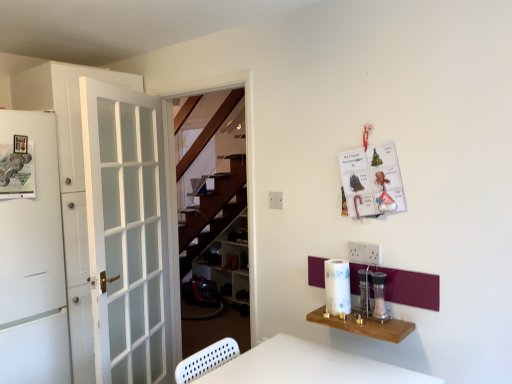
Image resolution: width=512 pixels, height=384 pixels. What are the coordinates of `free space in front of metallic silver salt and pepper shakers at center right, which appears as the 2th appliance when viewed from the right` in the screenshot? It's located at (377, 326).